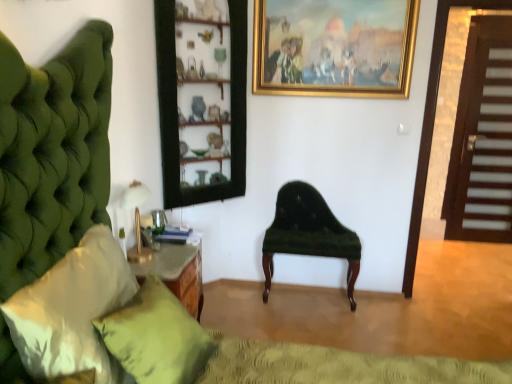
Locate an element on the screen. free space in front of velvet green bench at center is located at coordinates (321, 327).